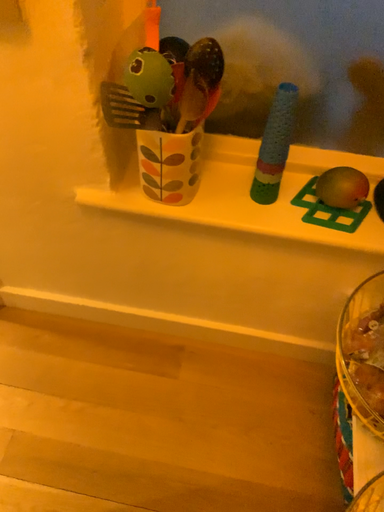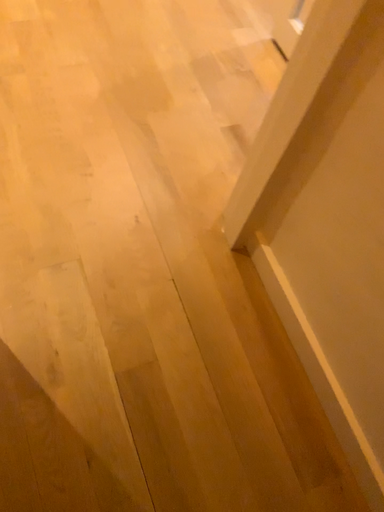
Question: How did the camera likely rotate when shooting the video?

Choices:
 (A) rotated right
 (B) rotated left

Answer: (B)